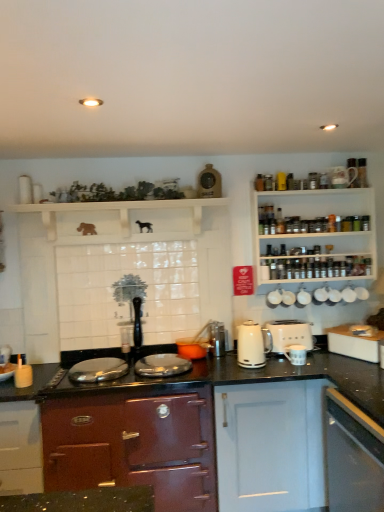
Identify the location of free space in front of white ceramic mug at lower center, the third appliance when ordered from left to right. (301, 371).